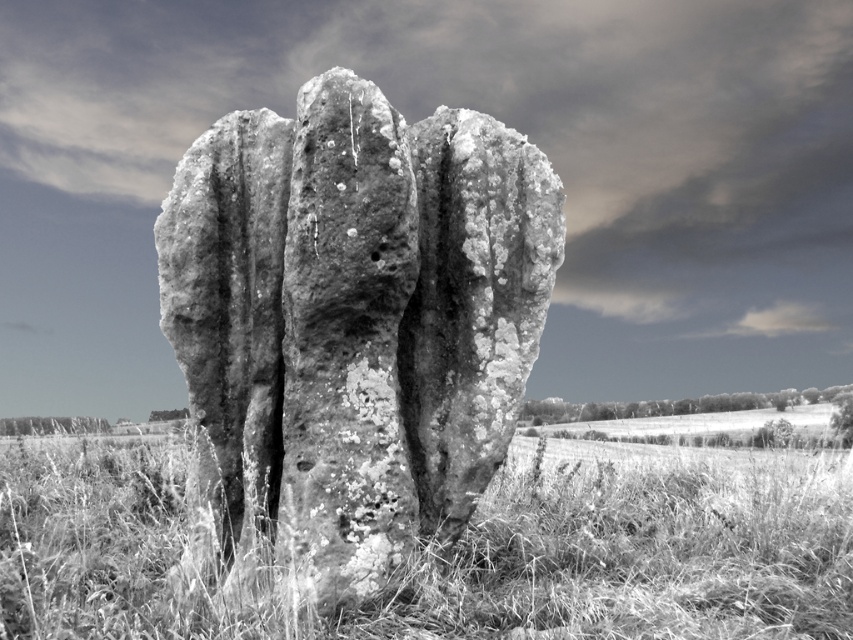
Question: Can you confirm if rough stone rock at center is positioned to the left of grassy field at lower center?

Choices:
 (A) no
 (B) yes

Answer: (B)

Question: Which of the following is the closest to the observer?

Choices:
 (A) (253, 125)
 (B) (668, 465)
 (C) (596, 432)

Answer: (A)

Question: Among these objects, which one is nearest to the camera?

Choices:
 (A) rough stone rock at center
 (B) fuzzy grass at center

Answer: (A)

Question: Which point is farther from the camera taking this photo?

Choices:
 (A) (811, 412)
 (B) (451, 564)

Answer: (A)

Question: Is rough stone rock at center smaller than fuzzy grass at center?

Choices:
 (A) yes
 (B) no

Answer: (B)

Question: Can you confirm if rough stone rock at center is thinner than fuzzy grass at center?

Choices:
 (A) yes
 (B) no

Answer: (B)